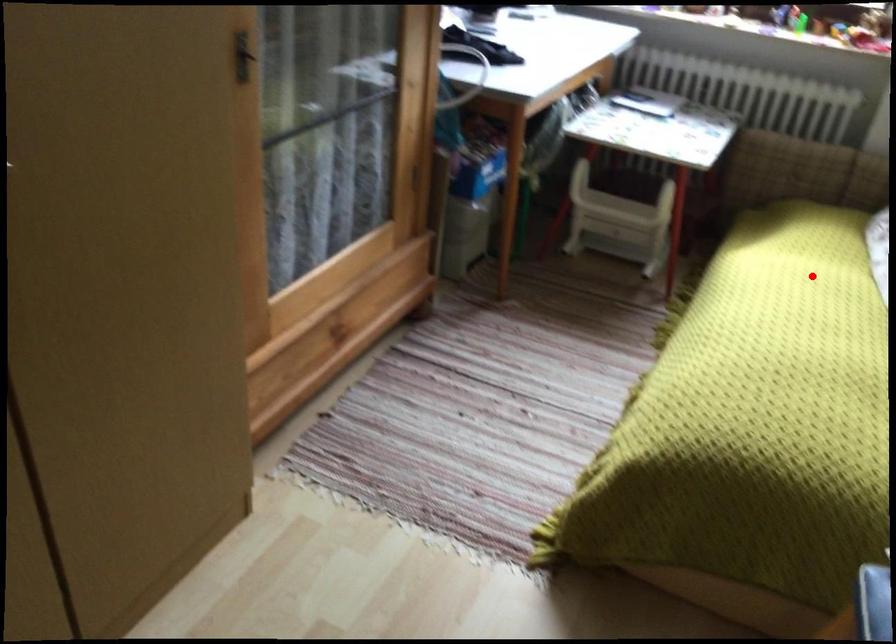
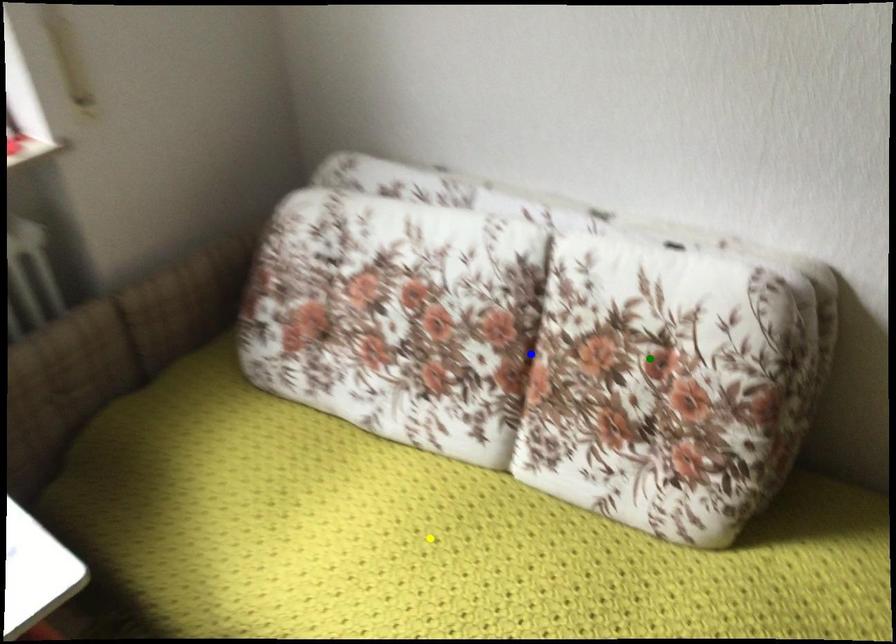
Question: I am providing you with two images of the same scene from different viewpoints. A red point is marked on the first image. You are given multiple points on the second image. Can you choose the point in image 2 that corresponds to the point in image 1?

Choices:
 (A) blue point
 (B) yellow point
 (C) green point

Answer: (B)